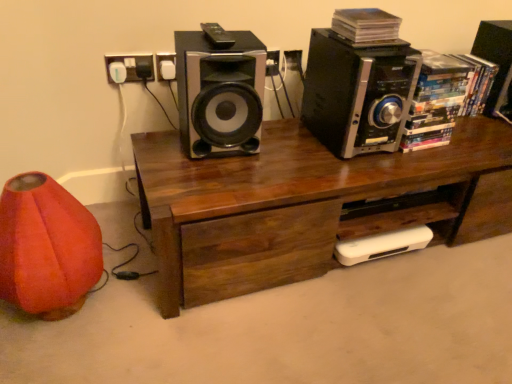
Locate an element on the screen. The width and height of the screenshot is (512, 384). free space in front of metallic silver speaker at center, which is counted as the 1th speaker, starting from the left is located at coordinates (216, 177).